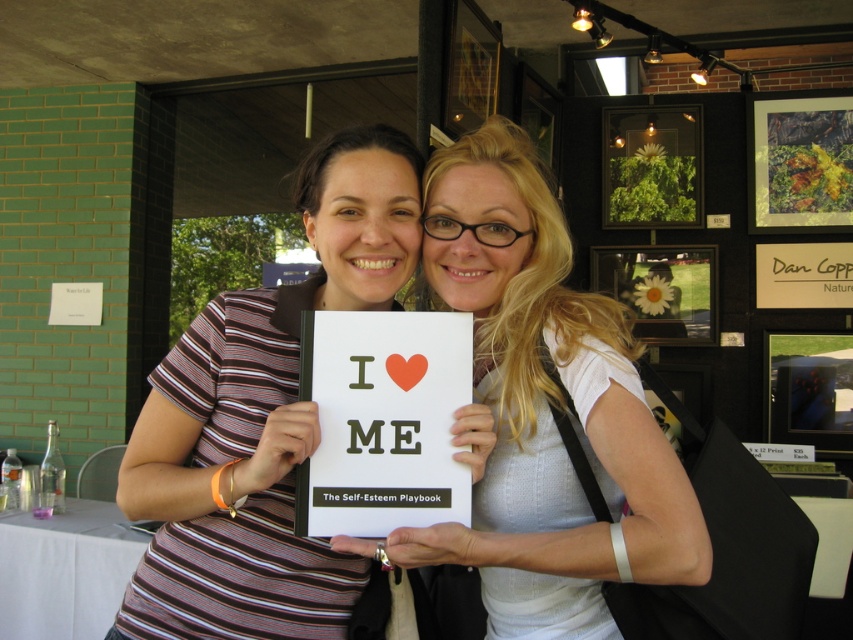
Consider the image. You are a photographer trying to capture a clear photo of the white paper book at center and the white paper at center. Which object is closer to the camera, making it easier to focus on?

The white paper book at center is in front of the white paper at center, so it is closer to the camera and easier to focus on.

You are a librarian organizing books on a shelf. You have two books in front of you, the white matte book at center and the white paper book at center. Which book should you place first if you want to arrange them from largest to smallest?

The white matte book at center should be placed first because it has a larger size compared to the white paper book at center.

You are a photographer trying to capture the white matte book at center in your shot. Based on the scene, where should you position yourself relative to the two women to ensure the book is clearly visible?

The white matte book at center is located at point (544,410), so positioning yourself directly in front of the book would ensure it is clearly visible in the frame.